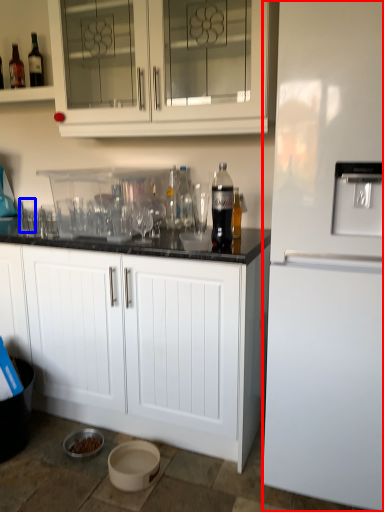
Question: Which object is closer to the camera taking this photo, refrigerator (highlighted by a red box) or shot glass (highlighted by a blue box)?

Choices:
 (A) refrigerator
 (B) shot glass

Answer: (A)